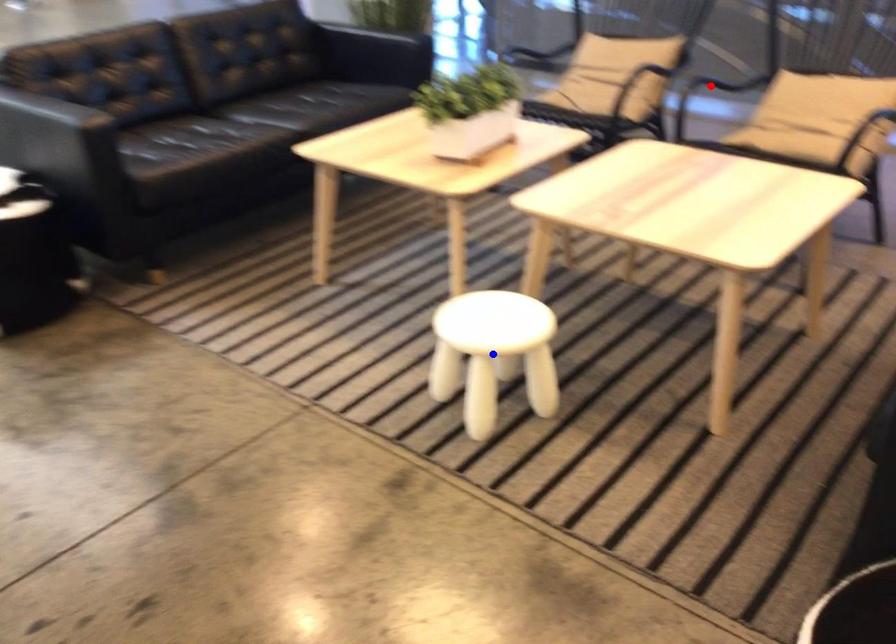
Question: Two points are marked on the image. Which point is closer to the camera?

Choices:
 (A) Blue point is closer.
 (B) Red point is closer.

Answer: (A)